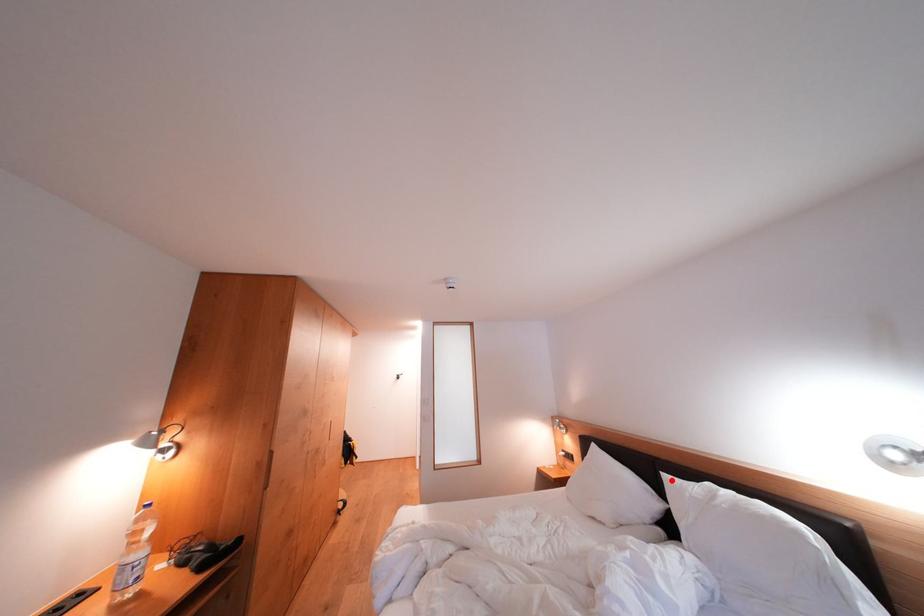
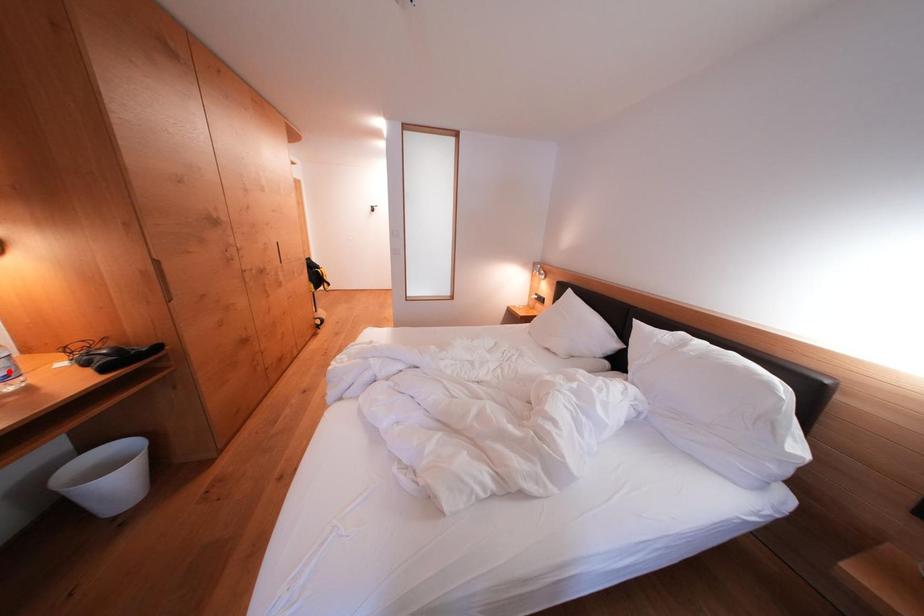
I am providing you with two images of the same scene from different viewpoints. A red point is marked on the first image and another point is marked on the second image. Do the highlighted points in image1 and image2 indicate the same real-world spot?

No